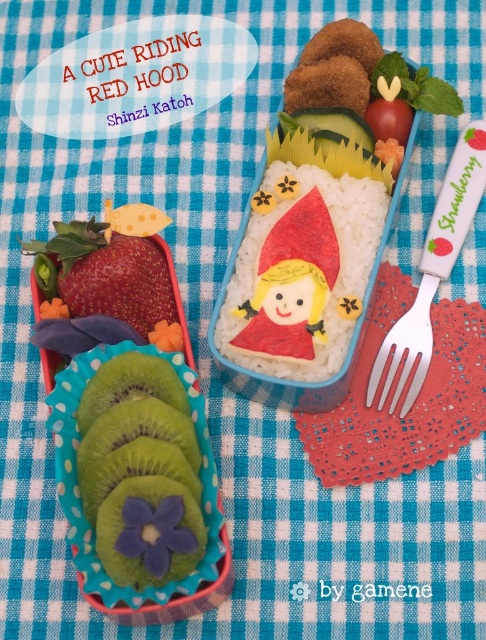
Can you confirm if white rice at center is smaller than green textured kiwi at lower left?

No, white rice at center is not smaller than green textured kiwi at lower left.

Does white rice at center appear over green textured kiwi at lower left?

Yes, white rice at center is above green textured kiwi at lower left.

Which is behind, point (328, 337) or point (87, 458)?

Point (328, 337)

The height and width of the screenshot is (640, 486). Find the location of `white rice at center`. white rice at center is located at coordinates (301, 273).

Consider the image. Who is positioned more to the left, green textured kiwi at lower left or silver metallic fork at right?

From the viewer's perspective, green textured kiwi at lower left appears more on the left side.

Does green textured kiwi at lower left have a larger size compared to silver metallic fork at right?

Yes.

Identify the location of green textured kiwi at lower left. (140, 472).

Is the position of green textured kiwi at lower left more distant than that of shiny red strawberry at left?

No, it is in front of shiny red strawberry at left.

Between green textured kiwi at lower left and shiny red strawberry at left, which one has less height?

Standing shorter between the two is shiny red strawberry at left.

Which is behind, point (93, 499) or point (71, 244)?

The point (71, 244) is more distant.

This screenshot has height=640, width=486. I want to click on green textured kiwi at lower left, so click(x=140, y=472).